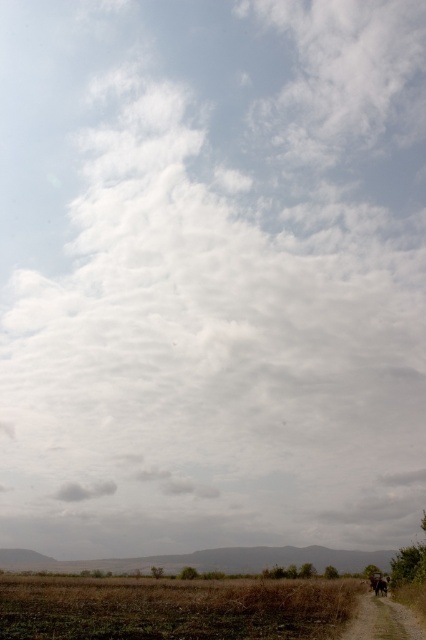
You are standing at the center of the image and want to walk towards the brown grassy field at lower center. In which direction should you move?

Since the brown grassy field at lower center is located at point 0.950 on the x axis and 0.406 on the y axis, you should move towards the lower right direction to reach it.

In the scene shown: You are standing in the middle of the brown grassy field at lower center and want to walk to the brown dirt track at lower right. Which direction should you head to reach the track?

The brown grassy field at lower center is in front of the brown dirt track at lower right, so you should head towards the direction where the dirt track is located, which is behind the field.

You are standing at the edge of the brown dirt track at lower right and want to walk towards the brown grassy field at lower center. Which direction should you move?

You should move to the left to reach the brown grassy field at lower center since it is positioned to the left of the brown dirt track at lower right.